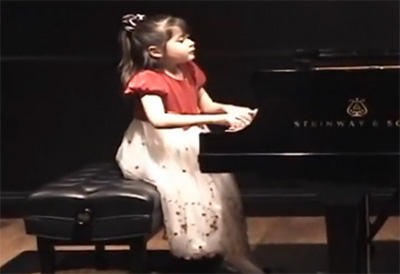
Where is `leather seat`? This screenshot has width=400, height=274. leather seat is located at coordinates pos(121,205).